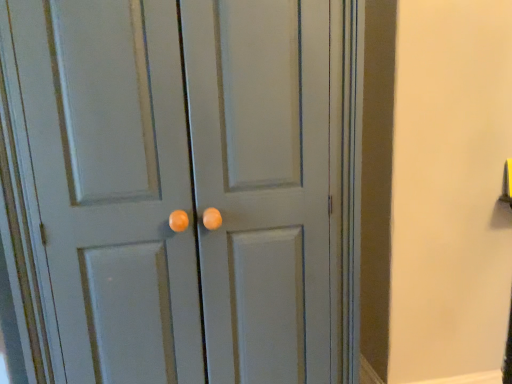
Question: Should I look upward or downward to see matte gray door at center?

Choices:
 (A) up
 (B) down

Answer: (B)